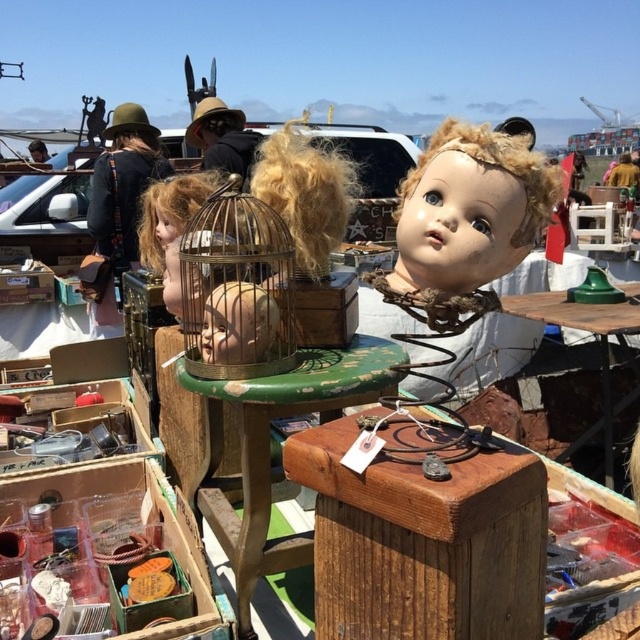
You are a customer at the flea market and want to buy the matte plastic doll head at upper right. The vendor tells you it is located at point (468, 211). Can you confirm if this point is on the wooden table?

The vendor says the matte plastic doll head at upper right is located at point (468, 211). Since the table is in the foreground and the coordinates are within the table area, the point is likely on the wooden table.

You are a customer at the flea market and want to buy the matte plastic doll head at upper right. The vendor tells you that it is located at coordinates point (468, 211). Based on the scene description, can you confirm if this point is indeed where the matte plastic doll head at upper right is placed?

Yes, according to the Objects Description, point (468, 211) corresponds to the matte plastic doll head at upper right.

You are a customer at the flea market and want to pick up the matte plastic doll head at upper right. Since you are standing in front of the wooden table at center, can you reach it without moving the table?

The matte plastic doll head at upper right is closer to the viewer than the wooden table at center, so you can reach it without moving the table.